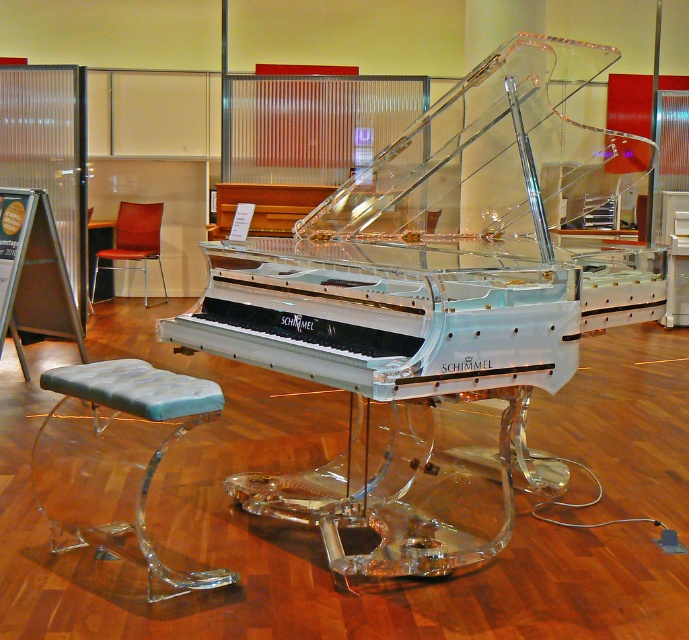
Question: Is clear acrylic stool at center bigger than leather seat at center?

Choices:
 (A) yes
 (B) no

Answer: (A)

Question: Among these points, which one is farthest from the camera?

Choices:
 (A) (577, 360)
 (B) (176, 387)
 (C) (136, 228)

Answer: (C)

Question: Among these objects, which one is farthest from the camera?

Choices:
 (A) transparent acrylic piano at center
 (B) leather seat at center

Answer: (B)

Question: Is transparent acrylic piano at center to the right of leather seat at center from the viewer's perspective?

Choices:
 (A) no
 (B) yes

Answer: (B)

Question: Is transparent acrylic piano at center behind leather seat at center?

Choices:
 (A) yes
 (B) no

Answer: (B)

Question: Which is farther from the transparent acrylic piano at center?

Choices:
 (A) leather seat at center
 (B) clear acrylic stool at center

Answer: (A)